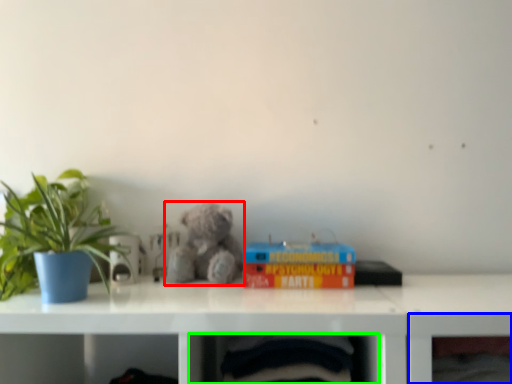
Question: Considering the real-world distances, which object is farthest from teddy bear (highlighted by a red box)? shelf (highlighted by a blue box) or shelf (highlighted by a green box)?

Choices:
 (A) shelf
 (B) shelf

Answer: (A)